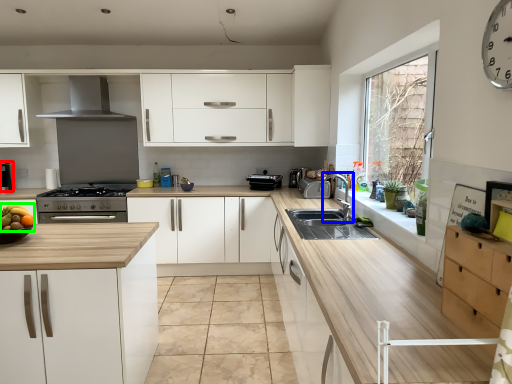
Question: Which is farther away from coffee machine (highlighted by a red box)? tap (highlighted by a blue box) or fruit (highlighted by a green box)?

Choices:
 (A) tap
 (B) fruit

Answer: (A)